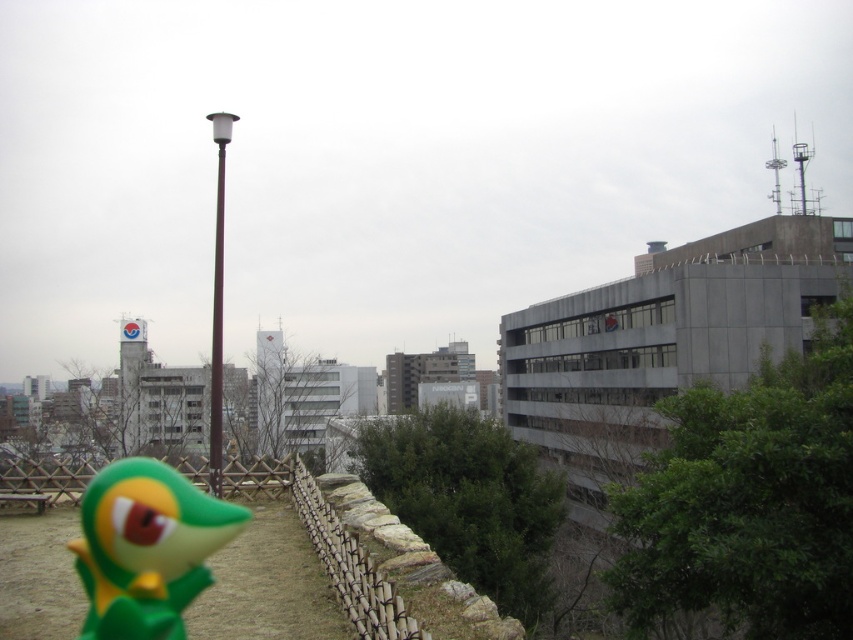
Does brown polished metal lamp post at center appear on the right side of smooth brown pole at center?

No, brown polished metal lamp post at center is not to the right of smooth brown pole at center.

Is brown polished metal lamp post at center in front of smooth brown pole at center?

No, it is behind smooth brown pole at center.

Is point (219, 262) positioned before point (213, 429)?

Yes, point (219, 262) is closer to viewer.

Locate an element on the screen. This screenshot has height=640, width=853. brown polished metal lamp post at center is located at coordinates (218, 307).

Can you confirm if green matte toy at lower left is bigger than smooth brown pole at center?

Incorrect, green matte toy at lower left is not larger than smooth brown pole at center.

Image resolution: width=853 pixels, height=640 pixels. I want to click on green matte toy at lower left, so click(x=146, y=547).

Where is `green matte toy at lower left`? green matte toy at lower left is located at coordinates (146, 547).

This screenshot has width=853, height=640. In order to click on green matte toy at lower left in this screenshot , I will do `click(146, 547)`.

Between green matte toy at lower left and brown polished metal lamp post at center, which one has less height?

green matte toy at lower left

Between point (236, 513) and point (218, 337), which one is positioned in front?

Positioned in front is point (218, 337).

Find the location of a particular element. The image size is (853, 640). green matte toy at lower left is located at coordinates (146, 547).